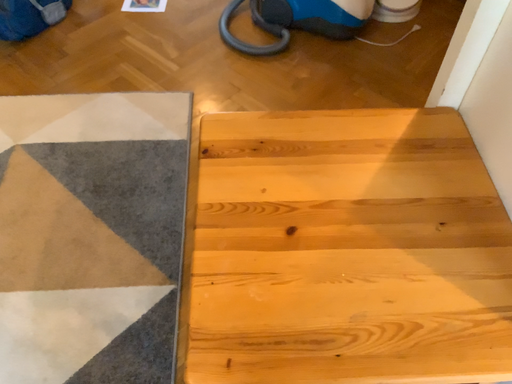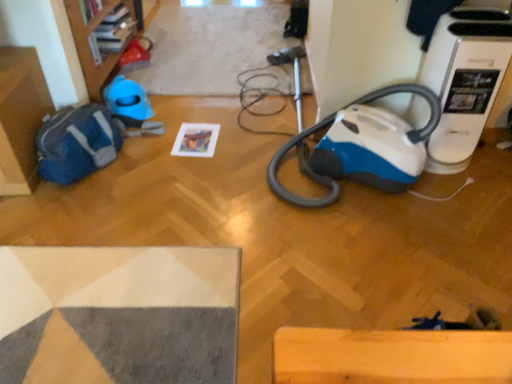
Question: Which way did the camera rotate in the video?

Choices:
 (A) rotated downward
 (B) rotated upward

Answer: (B)